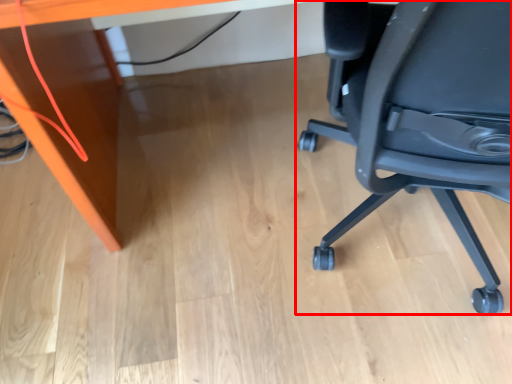
Question: Observing the image, what is the correct spatial positioning of chair (annotated by the red box) in reference to desk?

Choices:
 (A) right
 (B) left

Answer: (A)